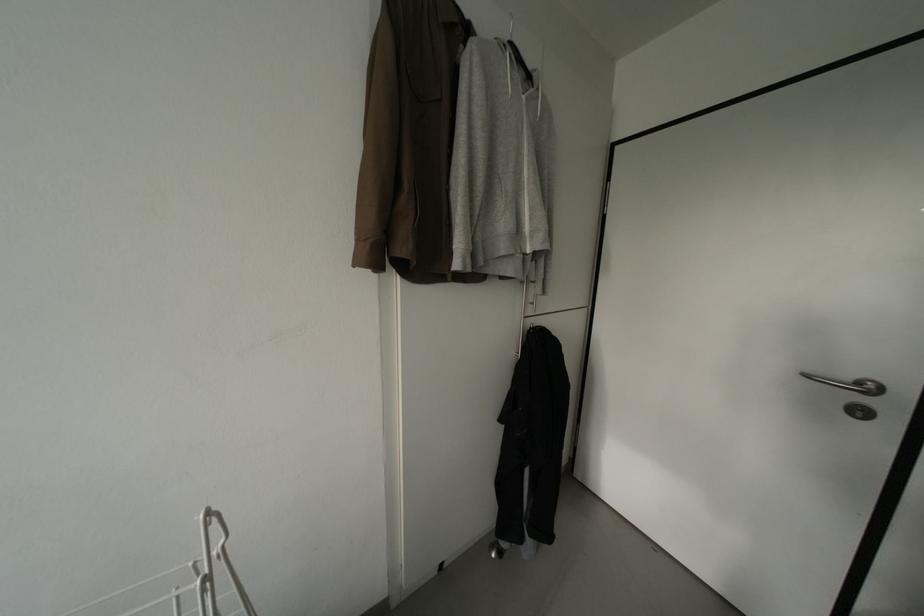
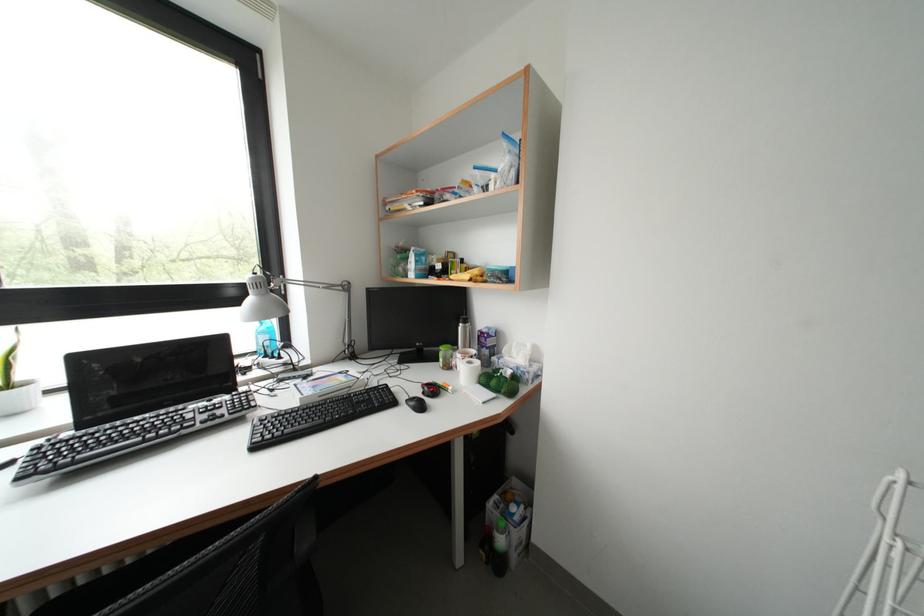
Question: The camera is either moving clockwise (left) or counter-clockwise (right) around the object. The first image is from the beginning of the video and the second image is from the end. Is the camera moving left or right when shooting the video?

Choices:
 (A) Left
 (B) Right

Answer: (B)